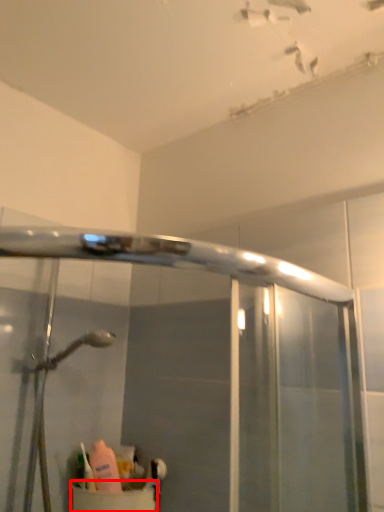
Question: In this image, where is sink (annotated by the red box) located relative to toiletry?

Choices:
 (A) right
 (B) left

Answer: (A)